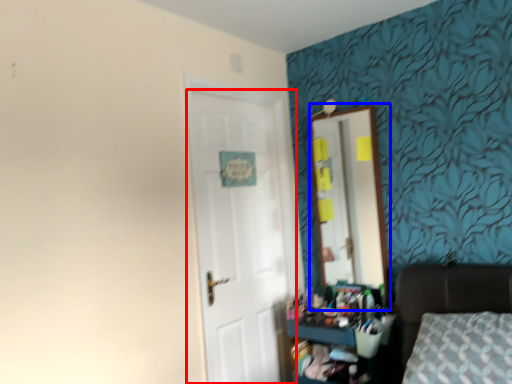
Question: Which object appears closest to the camera in this image, door (highlighted by a red box) or mirror (highlighted by a blue box)?

Choices:
 (A) door
 (B) mirror

Answer: (A)